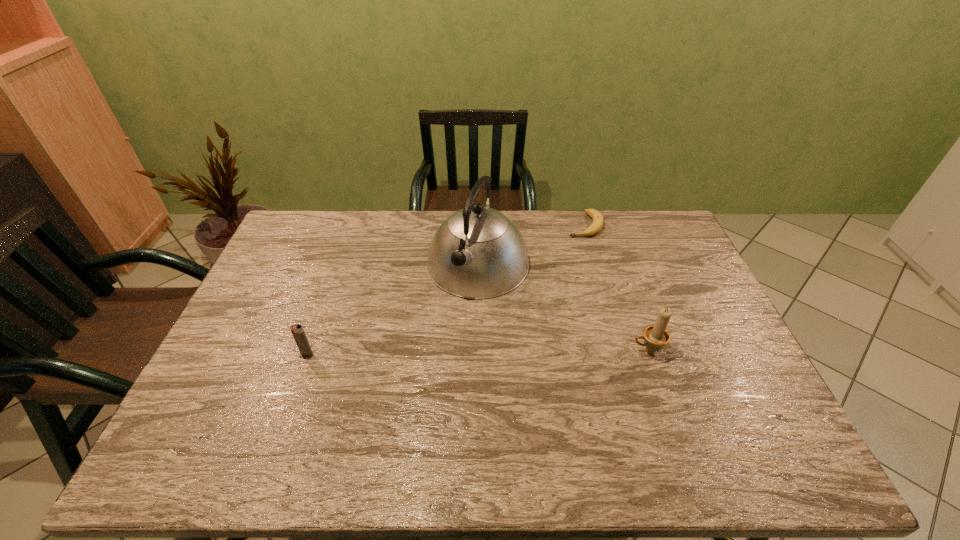
Find the location of `empty location between the third shortest object and the banana`. empty location between the third shortest object and the banana is located at coordinates (616, 287).

Find the location of a particular element. Image resolution: width=960 pixels, height=540 pixels. unoccupied position between the third shortest object and the third tallest object is located at coordinates (477, 352).

Where is `free space between the third shortest object and the second object from left to right`? free space between the third shortest object and the second object from left to right is located at coordinates (563, 307).

Choose which object is the third nearest neighbor to the second object from left to right. Please provide its 2D coordinates. Your answer should be formatted as a tuple, i.e. [(x, y)], where the tuple contains the x and y coordinates of a point satisfying the conditions above.

[(297, 330)]

Where is `object that is the closest one to the igniter`? This screenshot has width=960, height=540. object that is the closest one to the igniter is located at coordinates (477, 253).

Locate an element on the screen. Image resolution: width=960 pixels, height=540 pixels. free space that satisfies the following two spatial constraints: 1. on the front side of the shortest object; 2. on the handle side of the third shortest object is located at coordinates (621, 350).

Locate an element on the screen. vacant region that satisfies the following two spatial constraints: 1. on the front side of the shortest object; 2. on the handle side of the third shortest object is located at coordinates (621, 350).